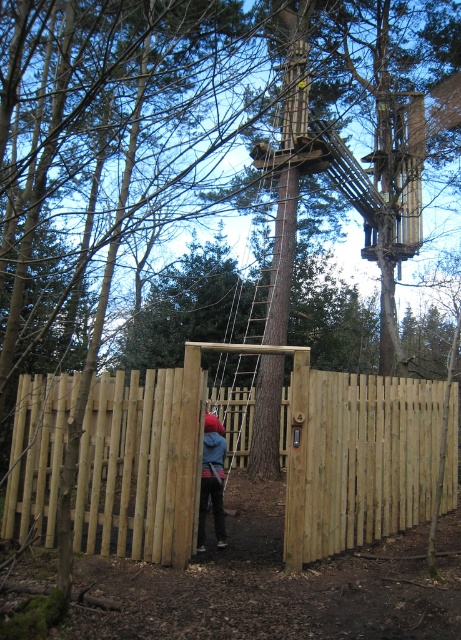
Question: Can you confirm if light brown wooden gate at center is positioned below blue denim jacket at center?

Choices:
 (A) yes
 (B) no

Answer: (B)

Question: Is light brown wooden gate at center bigger than blue denim jacket at center?

Choices:
 (A) no
 (B) yes

Answer: (B)

Question: Among these objects, which one is nearest to the camera?

Choices:
 (A) light brown wooden gate at center
 (B) blue denim jacket at center

Answer: (A)

Question: Which object appears farthest from the camera in this image?

Choices:
 (A) blue denim jacket at center
 (B) light brown wooden gate at center

Answer: (A)

Question: Where is light brown wooden gate at center located in relation to blue denim jacket at center in the image?

Choices:
 (A) right
 (B) left

Answer: (A)